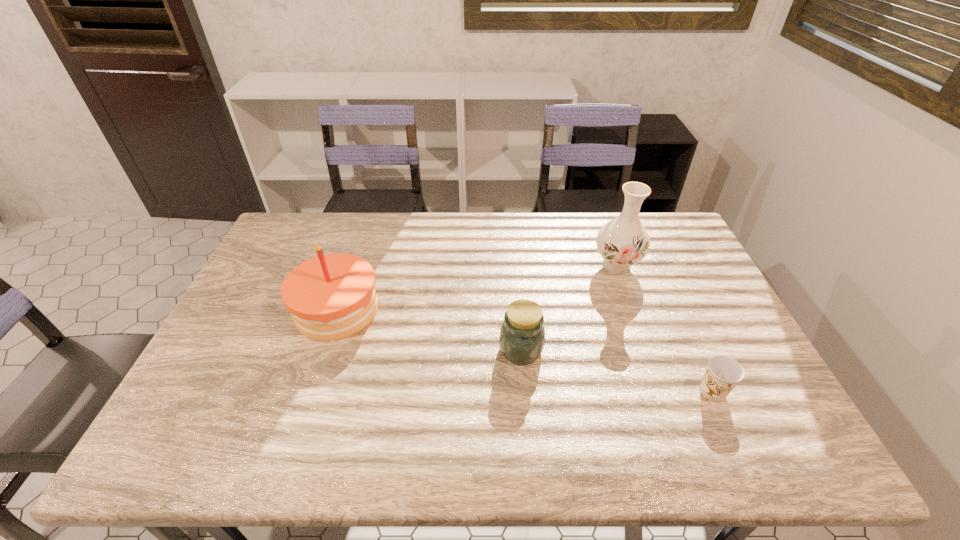
Image resolution: width=960 pixels, height=540 pixels. Identify the location of vacant area between the third object from left to right and the leftmost object. (477, 287).

Where is `empty space that is in between the third object from left to right and the leftmost object`? Image resolution: width=960 pixels, height=540 pixels. empty space that is in between the third object from left to right and the leftmost object is located at coordinates (477, 287).

Where is `free space between the shortest object and the third tallest object`? The height and width of the screenshot is (540, 960). free space between the shortest object and the third tallest object is located at coordinates (616, 370).

The image size is (960, 540). What are the coordinates of `blank region between the rightmost object and the vase` in the screenshot? It's located at (664, 328).

Point out which object is positioned as the third nearest to the jar. Please provide its 2D coordinates. Your answer should be formatted as a tuple, i.e. [(x, y)], where the tuple contains the x and y coordinates of a point satisfying the conditions above.

[(723, 373)]

Identify which object is the nearest to the shortest object. Please provide its 2D coordinates. Your answer should be formatted as a tuple, i.e. [(x, y)], where the tuple contains the x and y coordinates of a point satisfying the conditions above.

[(622, 242)]

Identify the location of vacant area that satisfies the following two spatial constraints: 1. on the front side of the rightmost object; 2. on the right side of the birthday cake. This screenshot has width=960, height=540. (310, 392).

Identify the location of free space that satisfies the following two spatial constraints: 1. on the front side of the shortest object; 2. on the left side of the vase. (661, 392).

This screenshot has height=540, width=960. What are the coordinates of `free space that satisfies the following two spatial constraints: 1. on the front side of the leftmost object; 2. on the right side of the third object from right to left` in the screenshot? It's located at (324, 349).

This screenshot has width=960, height=540. What are the coordinates of `free space in the image that satisfies the following two spatial constraints: 1. on the back side of the second shortest object; 2. on the left side of the vase` in the screenshot? It's located at (514, 266).